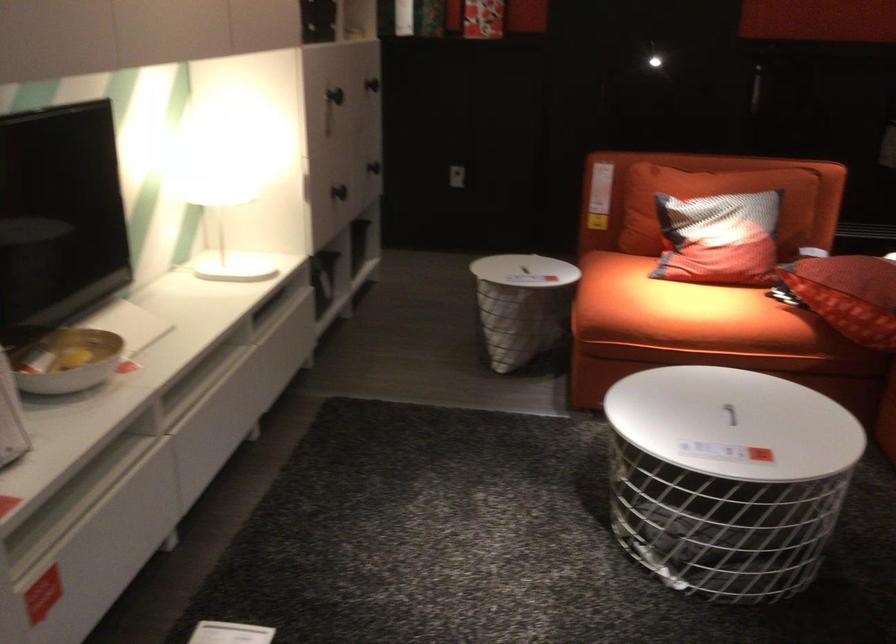
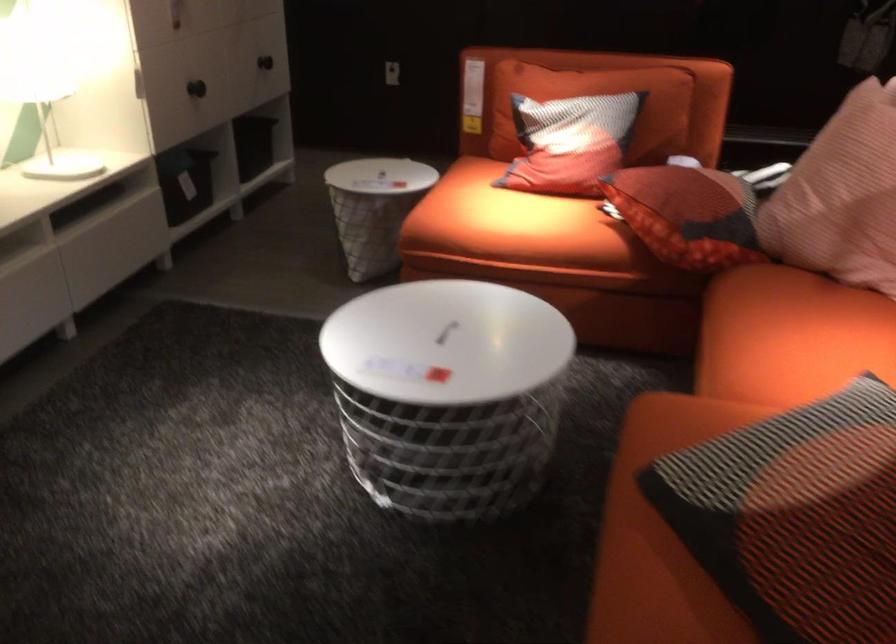
Question: Based on the continuous images, in which direction is the camera rotating? Reply with the corresponding letter.

Choices:
 (A) Left
 (B) Right
 (C) Up
 (D) Down

Answer: (D)